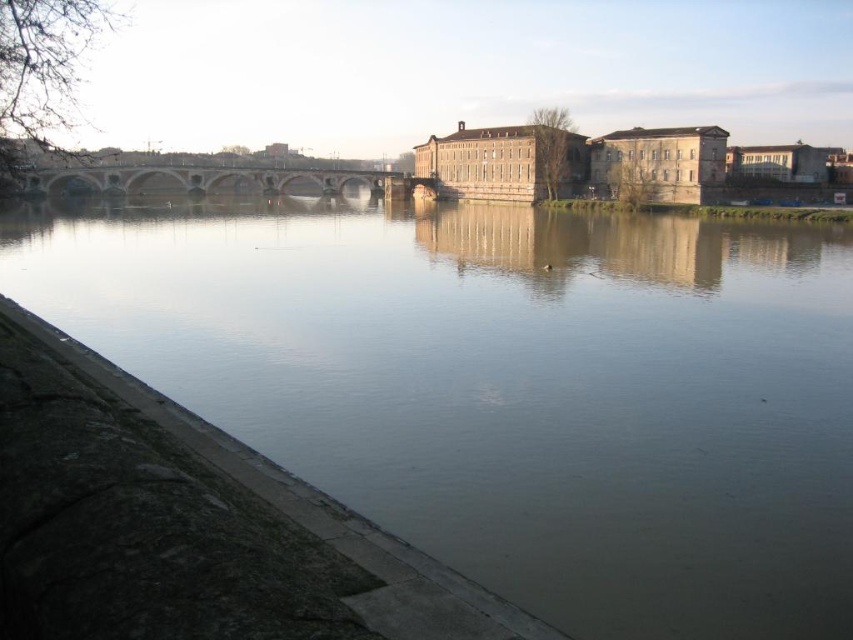
You are standing on the brown stone bridge at center and want to cross to the other side. Is the greenish water at lower left directly beneath you?

Yes, the greenish water at lower left is positioned under the brown stone bridge at center, so it is directly beneath you.

You are a boat captain trying to navigate a narrow boat through the river. The boat is 75 meters long. Can you safely pass between the greenish water at lower left and the brown stone bridge at center?

The distance between the greenish water at lower left and the brown stone bridge at center is 77.53 meters, which is slightly longer than the boat length of 75 meters. Therefore, the boat can safely pass through the gap as there is enough space.